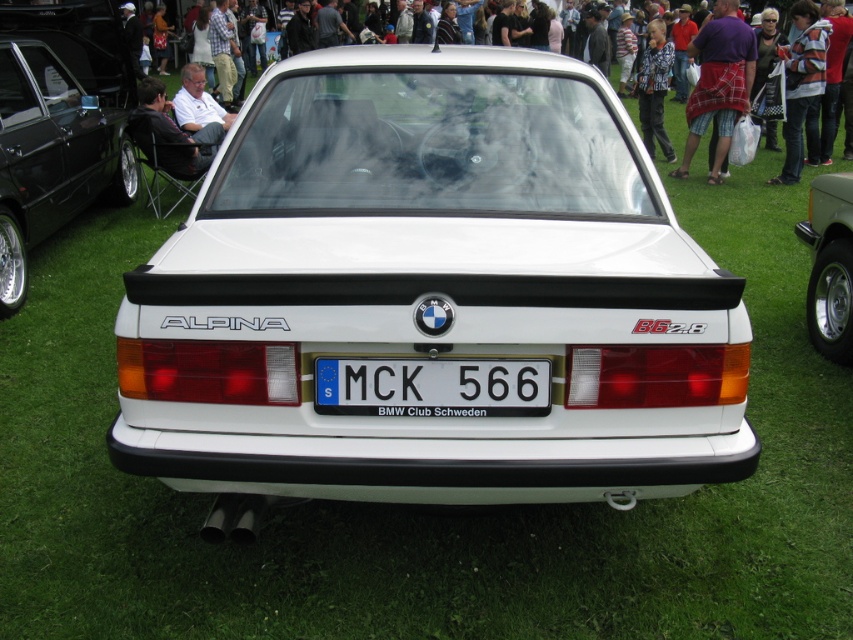
Question: Can you confirm if shiny black car at left is positioned above striped sweater at upper right?

Choices:
 (A) yes
 (B) no

Answer: (B)

Question: Is striped sweater at upper right wider than patterned shirt at center?

Choices:
 (A) no
 (B) yes

Answer: (B)

Question: Does white plastic license plate at center appear under plaid fabric kilt at center?

Choices:
 (A) yes
 (B) no

Answer: (A)

Question: Which object is positioned closest to the matte black car at center?

Choices:
 (A) white glossy car at center
 (B) white plastic license plate at center
 (C) shiny black car at left

Answer: (C)

Question: Which object is the closest to the white plastic license plate at center?

Choices:
 (A) matte black car at center
 (B) shiny black car at left
 (C) silver metallic car at right
 (D) striped sweater at upper right

Answer: (C)

Question: Which of these objects is positioned closest to the shiny black car at left?

Choices:
 (A) silver metallic car at right
 (B) white plastic license plate at center
 (C) patterned shirt at center

Answer: (B)